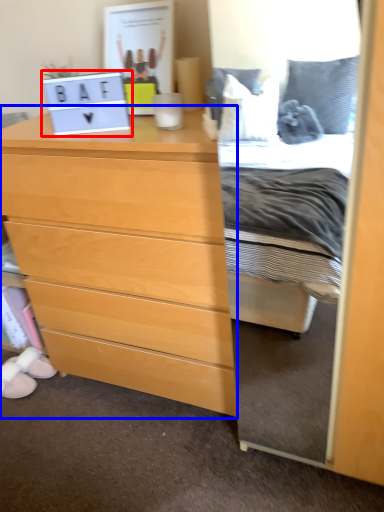
Question: Which point is further to the camera, laptop (highlighted by a red box) or chest of drawers (highlighted by a blue box)?

Choices:
 (A) laptop
 (B) chest of drawers

Answer: (A)